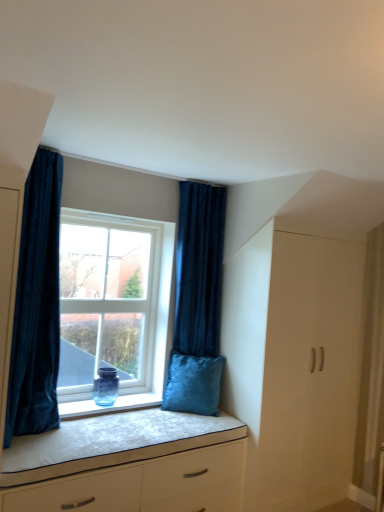
I want to click on vacant location below velvet dark blue curtain at left, which is the first curtain from left to right (from a real-world perspective), so click(39, 434).